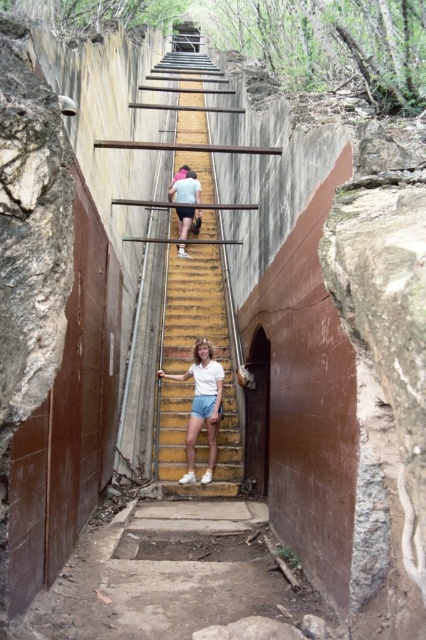
Question: Which is nearer to the yellow painted wood stairs at center?

Choices:
 (A) white matte shirt at center
 (B) white cotton shirt at center

Answer: (B)

Question: Can you confirm if white cotton shirt at center is bigger than white matte shirt at center?

Choices:
 (A) yes
 (B) no

Answer: (A)

Question: Does yellow painted wood stairs at center lie behind white cotton shirt at center?

Choices:
 (A) no
 (B) yes

Answer: (A)

Question: Which object appears farthest from the camera in this image?

Choices:
 (A) yellow painted wood stairs at center
 (B) white cotton shirt at center
 (C) white matte shirt at center

Answer: (C)

Question: Does yellow painted wood stairs at center have a lesser width compared to white cotton shirt at center?

Choices:
 (A) no
 (B) yes

Answer: (A)

Question: Which object is the farthest from the white cotton shirt at center?

Choices:
 (A) white matte shirt at center
 (B) yellow painted wood stairs at center

Answer: (A)